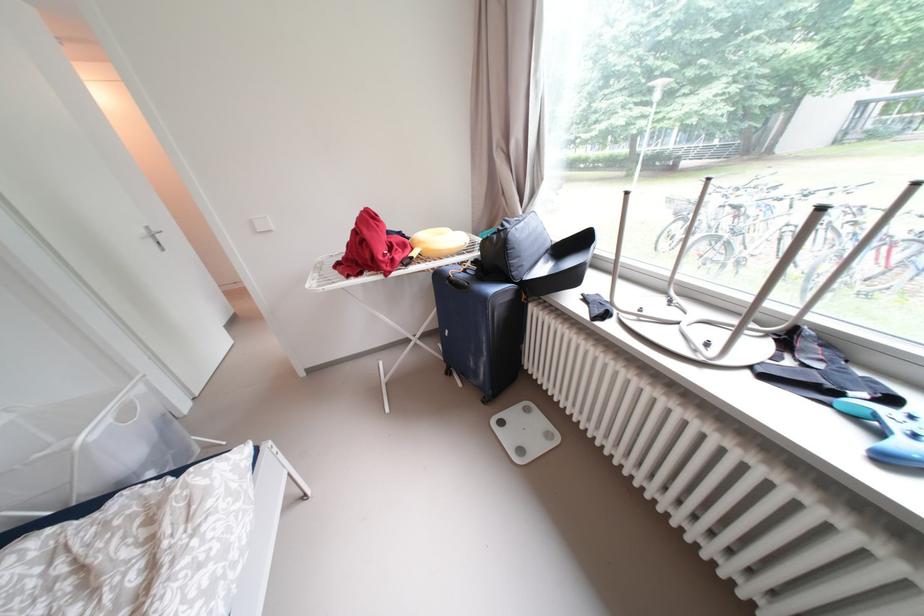
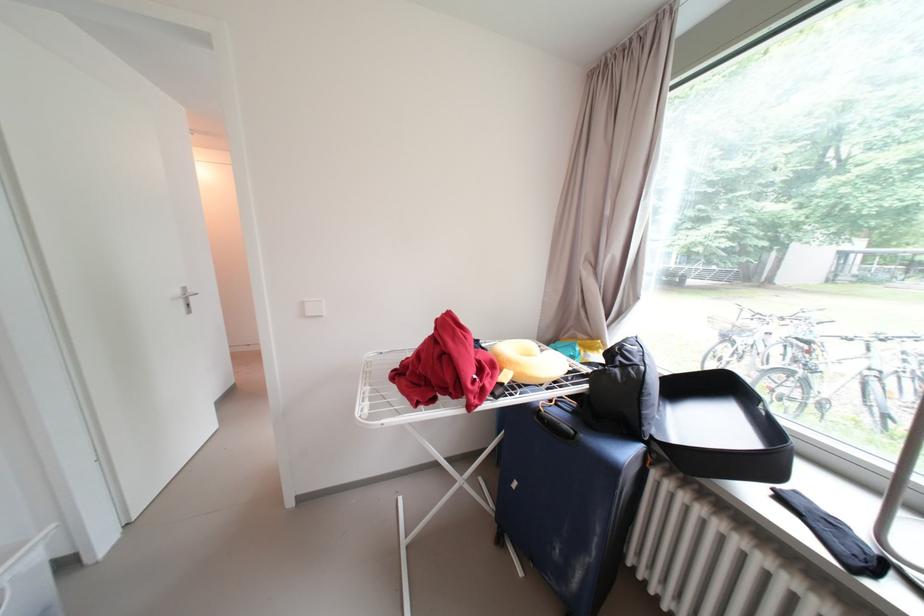
Where in the second image is the point corresponding to (x=151, y=233) from the first image?

(187, 293)